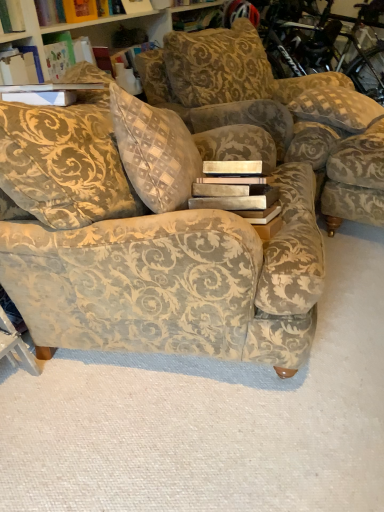
Question: From a real-world perspective, is velvet-patterned couch at center positioned over checkered fabric pillow at upper right based on gravity?

Choices:
 (A) no
 (B) yes

Answer: (A)

Question: Is velvet-patterned couch at center wider than checkered fabric pillow at upper right?

Choices:
 (A) yes
 (B) no

Answer: (A)

Question: Is checkered fabric pillow at upper right completely or partially inside velvet-patterned couch at center?

Choices:
 (A) yes
 (B) no

Answer: (B)

Question: From a real-world perspective, is velvet-patterned couch at center located beneath checkered fabric pillow at upper right?

Choices:
 (A) yes
 (B) no

Answer: (A)

Question: Is velvet-patterned couch at center at the left side of checkered fabric pillow at upper right?

Choices:
 (A) no
 (B) yes

Answer: (B)

Question: From a real-world perspective, is velvet floral armchair at right above or below velvet-patterned couch at center?

Choices:
 (A) above
 (B) below

Answer: (B)

Question: Relative to velvet-patterned couch at center, is velvet floral armchair at right in front or behind?

Choices:
 (A) behind
 (B) front

Answer: (A)

Question: Would you say velvet floral armchair at right is inside or outside velvet-patterned couch at center?

Choices:
 (A) outside
 (B) inside

Answer: (A)

Question: Based on their positions, is velvet floral armchair at right located to the left or right of velvet-patterned couch at center?

Choices:
 (A) left
 (B) right

Answer: (B)

Question: From a real-world perspective, is checkered fabric pillow at upper right physically located above or below velvet-patterned couch at center?

Choices:
 (A) above
 (B) below

Answer: (A)

Question: Considering the relative positions of checkered fabric pillow at upper right and velvet-patterned couch at center in the image provided, is checkered fabric pillow at upper right to the left or to the right of velvet-patterned couch at center?

Choices:
 (A) right
 (B) left

Answer: (A)

Question: In terms of size, does checkered fabric pillow at upper right appear bigger or smaller than velvet-patterned couch at center?

Choices:
 (A) small
 (B) big

Answer: (A)

Question: From their relative heights in the image, would you say checkered fabric pillow at upper right is taller or shorter than velvet-patterned couch at center?

Choices:
 (A) short
 (B) tall

Answer: (A)

Question: In terms of width, does checkered fabric pillow at upper right look wider or thinner when compared to velvet floral armchair at right?

Choices:
 (A) wide
 (B) thin

Answer: (A)

Question: Based on their sizes in the image, would you say checkered fabric pillow at upper right is bigger or smaller than velvet floral armchair at right?

Choices:
 (A) big
 (B) small

Answer: (B)